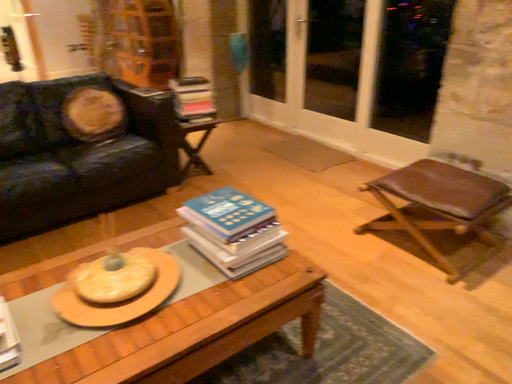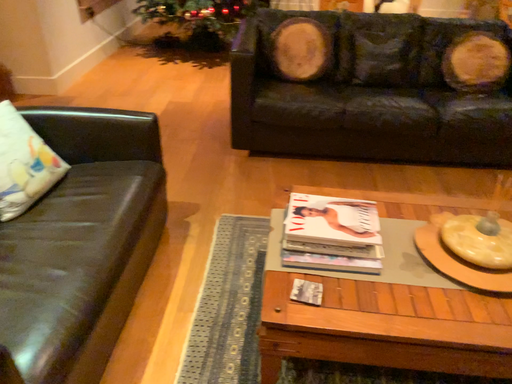
Question: How did the camera likely rotate when shooting the video?

Choices:
 (A) rotated left
 (B) rotated right

Answer: (A)